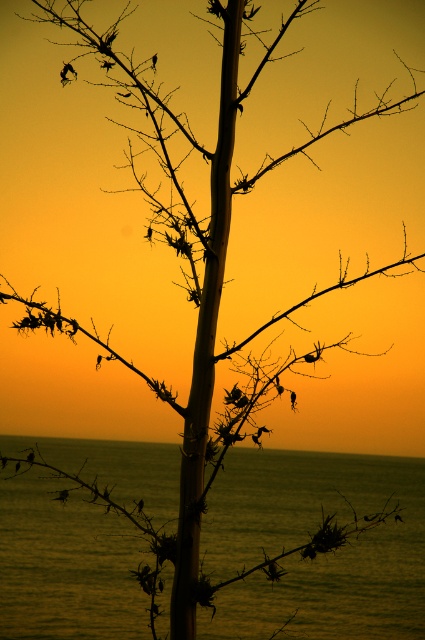
You are a photographer trying to capture the sunset reflection on the water. You notice the smooth water at center and the silvery metallic branch at center in your shot. Which object will have a more prominent reflection in the water?

The smooth water at center has a larger size compared to the silvery metallic branch at center, so the smooth water at center will have a more prominent reflection in the water.

You are a bird flying over the ocean and see the smooth water at center and the silhouette thorny branch at center. Which one is taller from your perspective?

The smooth water at center is taller than the silhouette thorny branch at center.

You are standing in front of the tree at sunset and want to know which point is closer to you. The points are point (404, 497) and point (405, 259). Which point is closer to your position?

Point (405, 259) is closer to you because it is less further to the camera than point (404, 497).